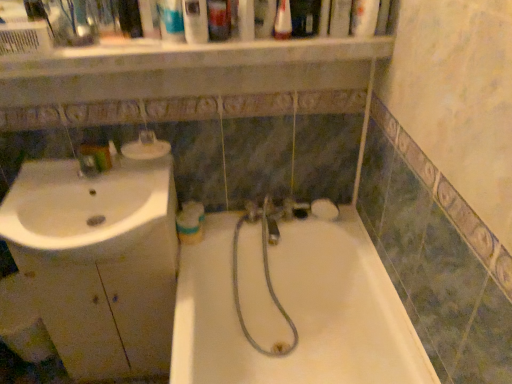
Question: In terms of width, does white glossy mouthwash at center, which is the 4th mouthwash in top-to-bottom order, look wider or thinner when compared to clear plastic bottle at upper center, which is the third mouthwash in back-to-front order?

Choices:
 (A) thin
 (B) wide

Answer: (B)

Question: Is white glossy mouthwash at center, which appears as the 4th mouthwash when viewed from the front, inside or outside of clear plastic bottle at upper center, the fourth mouthwash positioned from the bottom?

Choices:
 (A) inside
 (B) outside

Answer: (B)

Question: Estimate the real-world distances between objects in this image. Which object is farther from the translucent plastic soap dispenser at upper center, positioned as the 1th toiletry in top-to-bottom order?

Choices:
 (A) white glossy sink at left
 (B) clear plastic mouthwash at upper center, placed as the 2th mouthwash when sorted from top to bottom
 (C) matte plastic container at upper left, the second toiletry from the front
 (D) white glossy mouthwash at center, the 1th mouthwash from the left
 (E) blue plastic mouthwash at upper center, which is the second mouthwash in bottom-to-top order

Answer: (A)

Question: Based on their relative distances, which object is farther from the white glossy sink at left?

Choices:
 (A) white glossy mouthwash at center, placed as the first mouthwash when sorted from back to front
 (B) translucent plastic soap dispenser at upper center, positioned as the second toiletry in bottom-to-top order
 (C) clear plastic mouthwash at upper center, placed as the 2th mouthwash when sorted from top to bottom
 (D) white glossy sink at left
 (E) blue plastic mouthwash at upper center, which ranks as the third mouthwash in top-to-bottom order

Answer: (B)